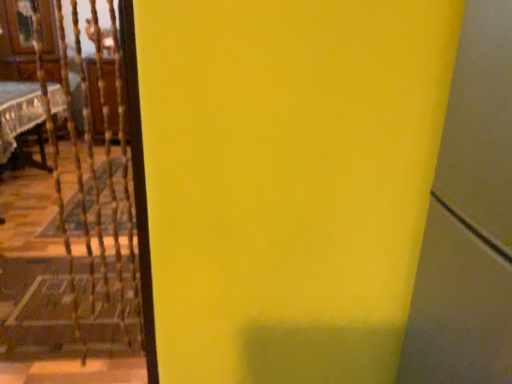
What do you see at coordinates (18, 114) in the screenshot? I see `wooden table at left` at bounding box center [18, 114].

The image size is (512, 384). Find the location of `wooden table at left`. wooden table at left is located at coordinates (18, 114).

What are the coordinates of `wooden table at left` in the screenshot? It's located at (18, 114).